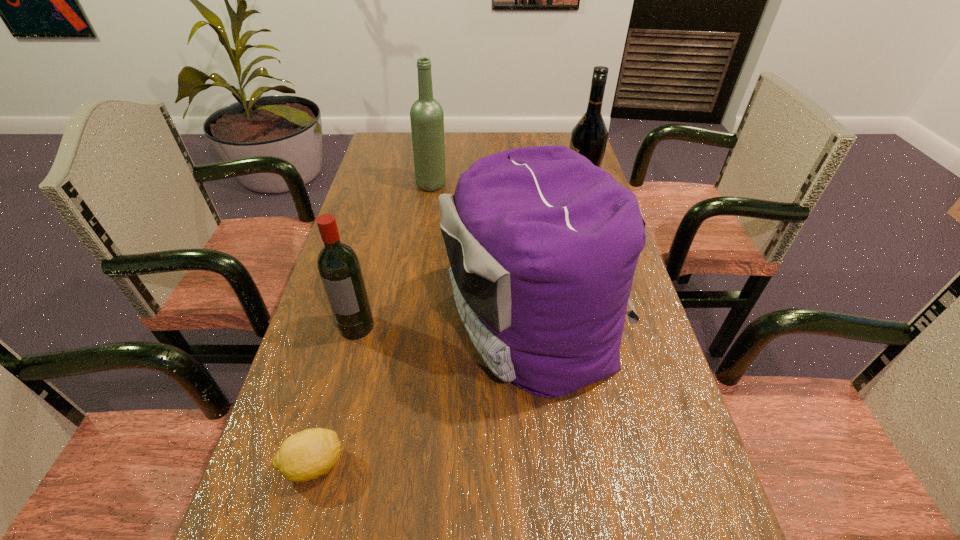
Locate an element on the screen. This screenshot has height=540, width=960. free spot at the far edge of the desktop is located at coordinates (453, 138).

The height and width of the screenshot is (540, 960). In the image, there is a desktop. Identify the location of vacant space at the left edge. (367, 282).

You are a GUI agent. You are given a task and a screenshot of the screen. Output one action in this format:
    pyautogui.click(x=<x>, y=<y>)
    Task: Click on the free space at the right edge of the desktop
    This screenshot has height=540, width=960.
    Given the screenshot: What is the action you would take?
    pyautogui.click(x=650, y=333)

Find the location of a particular element. The height and width of the screenshot is (540, 960). vacant space at the far left corner is located at coordinates (376, 163).

At what (x,y) coordinates should I click in order to perform the action: click on free space at the far right corner. Please return your answer as a coordinate pair (x, y). Looking at the image, I should click on (539, 137).

This screenshot has height=540, width=960. In order to click on vacant area that lies between the nearest object and the backpack in this screenshot , I will do `click(424, 393)`.

At what (x,y) coordinates should I click in order to perform the action: click on free space between the second shortest object and the lemon. Please return your answer as a coordinate pair (x, y). Looking at the image, I should click on (335, 395).

Image resolution: width=960 pixels, height=540 pixels. I want to click on vacant space that's between the backpack and the nearest object, so click(x=424, y=393).

Identify the location of vacant area that lies between the lemon and the backpack. (424, 393).

Identify the location of free spot between the shortest object and the nearest wine bottle. The width and height of the screenshot is (960, 540). pos(335,395).